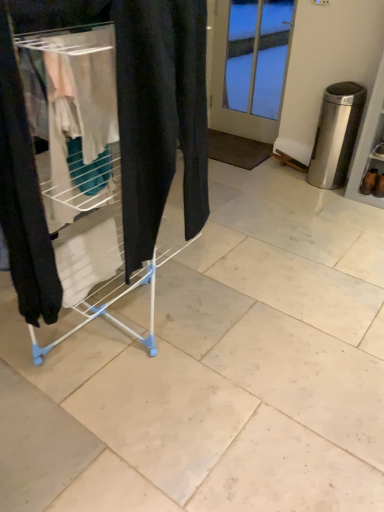
Image resolution: width=384 pixels, height=512 pixels. In order to click on vacant space in white plastic drying rack at left (from a real-world perspective) in this screenshot , I will do `click(113, 328)`.